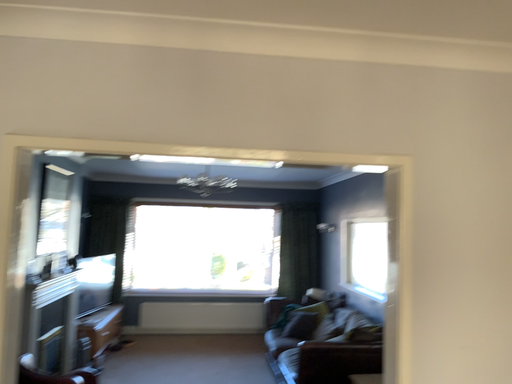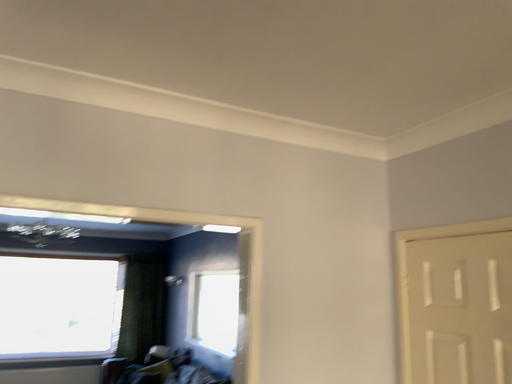
Question: Which way did the camera rotate in the video?

Choices:
 (A) rotated right
 (B) rotated left

Answer: (A)